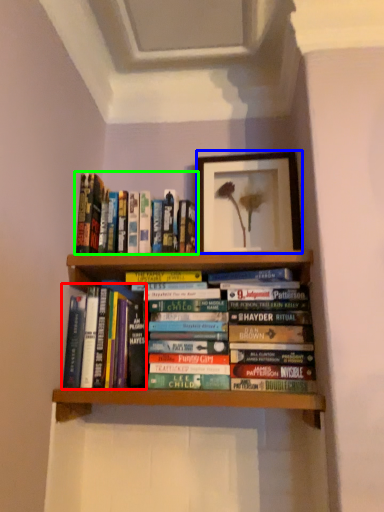
Question: Which object is the farthest from book (highlighted by a red box)? Choose among these: picture frame (highlighted by a blue box) or book (highlighted by a green box).

Choices:
 (A) picture frame
 (B) book

Answer: (A)